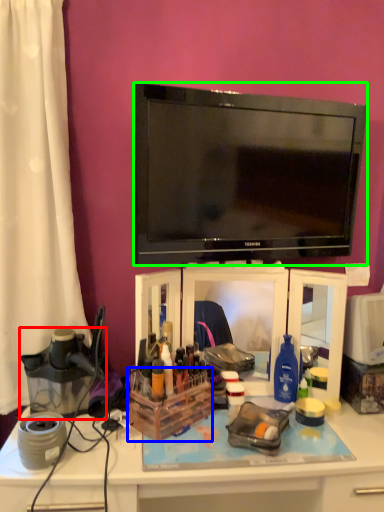
Question: Which object is the closest to the appliance (highlighted by a red box)? Choose among these: storage box (highlighted by a blue box) or television (highlighted by a green box).

Choices:
 (A) storage box
 (B) television

Answer: (A)